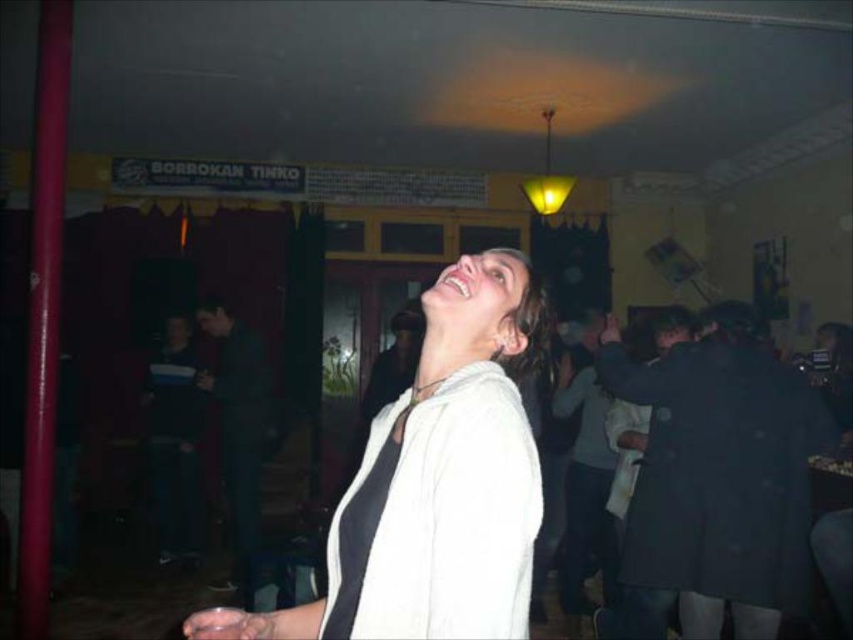
Does white matte jacket at center have a lesser height compared to white soft sweatshirt at center?

No, white matte jacket at center is not shorter than white soft sweatshirt at center.

Who is more forward, [460,403] or [393,596]?

Point [393,596]

Find the location of a particular element. white matte jacket at center is located at coordinates (434, 484).

I want to click on white matte jacket at center, so click(434, 484).

Can you confirm if white matte jacket at center is smaller than black matte sweatshirt at right?

Yes, white matte jacket at center is smaller than black matte sweatshirt at right.

Identify the location of white matte jacket at center. (434, 484).

Is black matte sweatshirt at right below white soft sweatshirt at center?

Yes.

Which is behind, point (740, 403) or point (341, 529)?

Point (740, 403)

You are a GUI agent. You are given a task and a screenshot of the screen. Output one action in this format:
    pyautogui.click(x=<x>, y=<y>)
    Task: Click on the black matte sweatshirt at right
    This screenshot has height=640, width=853.
    Given the screenshot: What is the action you would take?
    pyautogui.click(x=721, y=472)

This screenshot has width=853, height=640. I want to click on black matte sweatshirt at right, so click(721, 472).